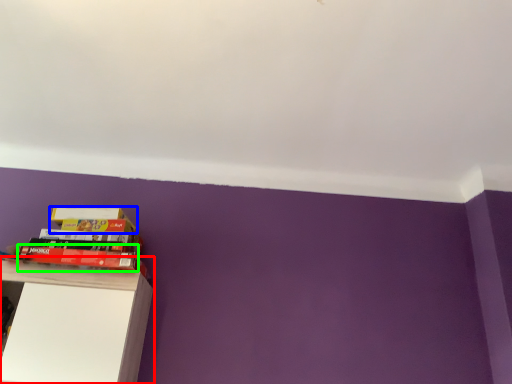
Question: Considering the real-world distances, which object is farthest from shelf (highlighted by a red box)? paperback book (highlighted by a blue box) or paperback book (highlighted by a green box)?

Choices:
 (A) paperback book
 (B) paperback book

Answer: (A)